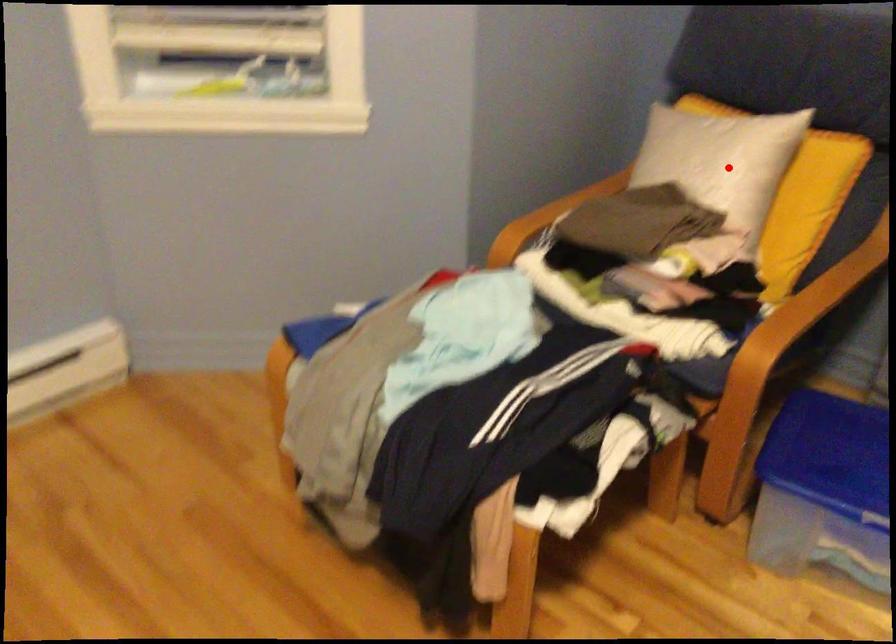
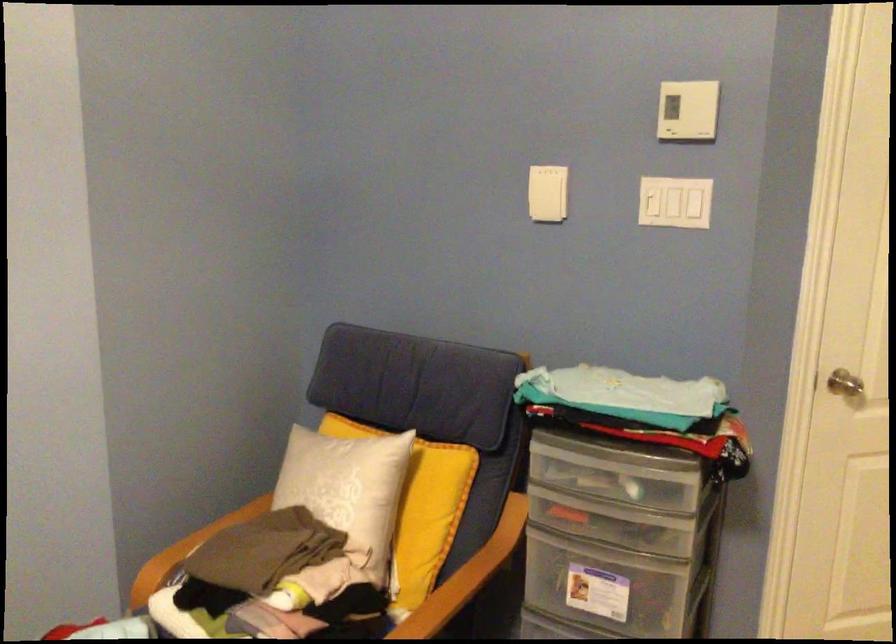
Where in the second image is the point corresponding to the highlighted location from the first image?

(348, 488)